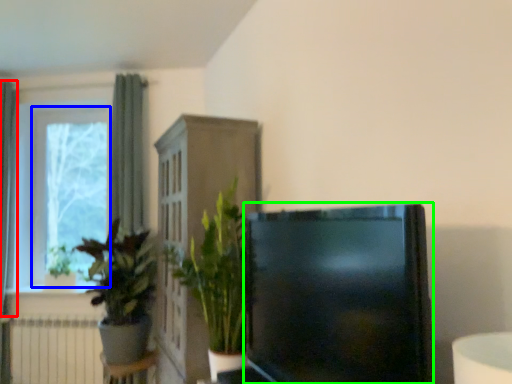
Question: Considering the real-world distances, which object is farthest from curtain (highlighted by a red box)? window frame (highlighted by a blue box) or television (highlighted by a green box)?

Choices:
 (A) window frame
 (B) television

Answer: (B)